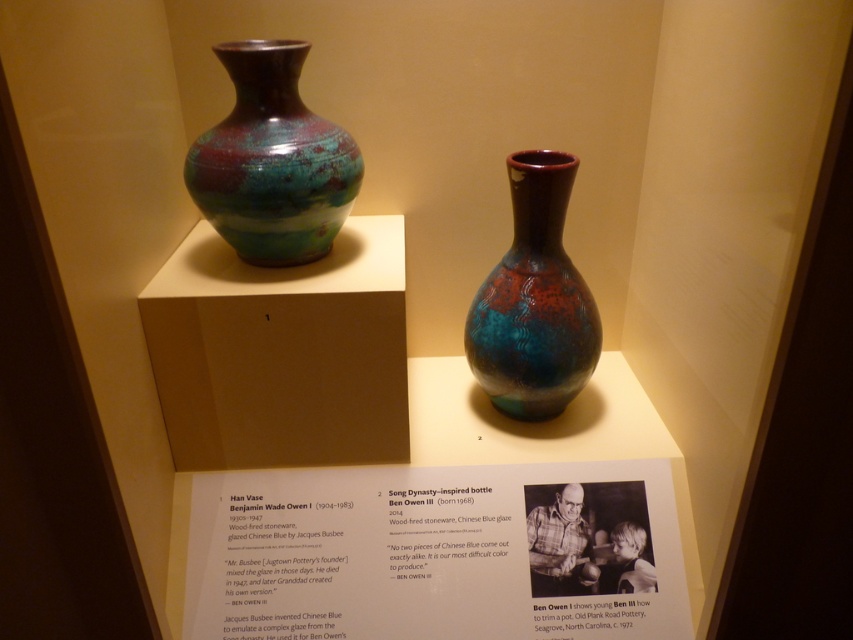
Who is lower down, matte glazed vase at center or teal-glazed stoneware vase at center?

Positioned lower is teal-glazed stoneware vase at center.

What do you see at coordinates (271, 161) in the screenshot? The width and height of the screenshot is (853, 640). I see `matte glazed vase at center` at bounding box center [271, 161].

You are a GUI agent. You are given a task and a screenshot of the screen. Output one action in this format:
    pyautogui.click(x=<x>, y=<y>)
    Task: Click on the matte glazed vase at center
    
    Given the screenshot: What is the action you would take?
    pyautogui.click(x=271, y=161)